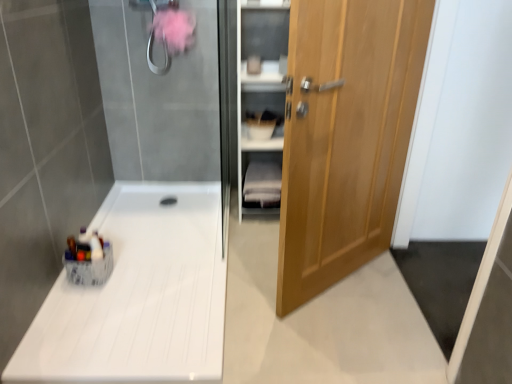
Measure the distance between point (368, 111) and camera.

The distance of point (368, 111) from camera is 1.76 meters.

Where is `light brown wooden door at right`? This screenshot has height=384, width=512. light brown wooden door at right is located at coordinates (345, 136).

Where is `white fabric shelf at center`? This screenshot has width=512, height=384. white fabric shelf at center is located at coordinates (261, 182).

Is white fabric shelf at center at the left side of light brown wooden door at right?

Yes.

Considering the sizes of objects white fabric shelf at center and light brown wooden door at right in the image provided, who is taller, white fabric shelf at center or light brown wooden door at right?

Standing taller between the two is light brown wooden door at right.

Considering the sizes of white fabric shelf at center and light brown wooden door at right in the image, is white fabric shelf at center bigger or smaller than light brown wooden door at right?

Considering their sizes, white fabric shelf at center takes up less space than light brown wooden door at right.

Between point (263, 172) and point (307, 267), which one is positioned behind?

Point (263, 172)

Does light brown wooden door at right have a greater width compared to wooden cabinet at right?

No.

Does light brown wooden door at right have a greater height compared to wooden cabinet at right?

Indeed, light brown wooden door at right has a greater height compared to wooden cabinet at right.

From a real-world perspective, which object stands above the other?

From a 3D spatial view, light brown wooden door at right is above.

Is light brown wooden door at right oriented away from wooden cabinet at right?

That's right, light brown wooden door at right is facing away from wooden cabinet at right.

Is point (296, 50) closer to viewer compared to point (267, 186)?

Yes, point (296, 50) is in front of point (267, 186).

Image resolution: width=512 pixels, height=384 pixels. Identify the location of shelf located on the left of light brown wooden door at right. (261, 182).

Considering the relative sizes of light brown wooden door at right and white fabric shelf at center in the image provided, is light brown wooden door at right shorter than white fabric shelf at center?

No, light brown wooden door at right is not shorter than white fabric shelf at center.

Could you tell me if light brown wooden door at right is facing white fabric shelf at center?

No, light brown wooden door at right does not turn towards white fabric shelf at center.

The height and width of the screenshot is (384, 512). Identify the location of counter top on the left side of wooden cabinet at right. (138, 296).

Can you confirm if white glossy counter top at lower left is positioned to the right of wooden cabinet at right?

No.

From a real-world perspective, who is located higher, white glossy counter top at lower left or wooden cabinet at right?

wooden cabinet at right is physically above.

Where is `cabinet to the right of white glossy counter top at lower left`? Image resolution: width=512 pixels, height=384 pixels. cabinet to the right of white glossy counter top at lower left is located at coordinates (261, 103).

How many degrees apart are the facing directions of wooden cabinet at right and white glossy counter top at lower left?

The angle between the facing direction of wooden cabinet at right and the facing direction of white glossy counter top at lower left is 1.4 degrees.

From a real-world perspective, between wooden cabinet at right and white glossy counter top at lower left, who is vertically lower?

white glossy counter top at lower left.

Is wooden cabinet at right aimed at white glossy counter top at lower left?

No, wooden cabinet at right does not turn towards white glossy counter top at lower left.

Measure the distance from white glossy counter top at lower left to white fabric shelf at center.

white glossy counter top at lower left is 27.75 inches from white fabric shelf at center.

Considering the positions of points (106, 224) and (263, 161), is point (106, 224) farther from camera compared to point (263, 161)?

No, it is in front of (263, 161).

Does white glossy counter top at lower left appear on the left side of white fabric shelf at center?

Yes, white glossy counter top at lower left is to the left of white fabric shelf at center.

Does white glossy counter top at lower left have a greater height compared to white fabric shelf at center?

Incorrect, the height of white glossy counter top at lower left is not larger of that of white fabric shelf at center.

Is wooden cabinet at right taller or shorter than light brown wooden door at right?

wooden cabinet at right is shorter than light brown wooden door at right.

Which of these two, wooden cabinet at right or light brown wooden door at right, is smaller?

With smaller size is wooden cabinet at right.

In the scene shown: From the image's perspective, is wooden cabinet at right on light brown wooden door at right?

Indeed, from the image's perspective, wooden cabinet at right is shown above light brown wooden door at right.

Where is `shelf lying on the left of light brown wooden door at right`? The height and width of the screenshot is (384, 512). shelf lying on the left of light brown wooden door at right is located at coordinates pyautogui.click(x=261, y=182).

Identify the location of door lying in front of the wooden cabinet at right. (345, 136).

Which object lies nearer to the anchor point white fabric shelf at center, wooden cabinet at right or white glossy counter top at lower left?

Among the two, wooden cabinet at right is located nearer to white fabric shelf at center.

When comparing their distances from wooden cabinet at right, does white glossy counter top at lower left or white fabric shelf at center seem closer?

The object closer to wooden cabinet at right is white fabric shelf at center.

Estimate the real-world distances between objects in this image. Which object is further from light brown wooden door at right, white fabric shelf at center or white glossy counter top at lower left?

white fabric shelf at center lies further to light brown wooden door at right than the other object.

When comparing their distances from wooden cabinet at right, does white glossy counter top at lower left or light brown wooden door at right seem closer?

white glossy counter top at lower left is positioned closer to the anchor wooden cabinet at right.

Which object lies nearer to the anchor point white fabric shelf at center, white glossy counter top at lower left or wooden cabinet at right?

The object closer to white fabric shelf at center is wooden cabinet at right.

When comparing their distances from white fabric shelf at center, does wooden cabinet at right or light brown wooden door at right seem closer?

wooden cabinet at right is positioned closer to the anchor white fabric shelf at center.

When comparing their distances from white glossy counter top at lower left, does light brown wooden door at right or wooden cabinet at right seem further?

light brown wooden door at right is further to white glossy counter top at lower left.

Looking at the image, which one is located further to wooden cabinet at right, white fabric shelf at center or white glossy counter top at lower left?

white glossy counter top at lower left is positioned further to the anchor wooden cabinet at right.

In order to click on cabinet between light brown wooden door at right and white fabric shelf at center from front to back in this screenshot , I will do `click(261, 103)`.

The image size is (512, 384). I want to click on cabinet between white glossy counter top at lower left and white fabric shelf at center from front to back, so click(261, 103).

The image size is (512, 384). In order to click on counter top between light brown wooden door at right and white fabric shelf at center from front to back in this screenshot , I will do `click(138, 296)`.

Where is `cabinet located between white glossy counter top at lower left and light brown wooden door at right in the left-right direction`? Image resolution: width=512 pixels, height=384 pixels. cabinet located between white glossy counter top at lower left and light brown wooden door at right in the left-right direction is located at coordinates (261, 103).